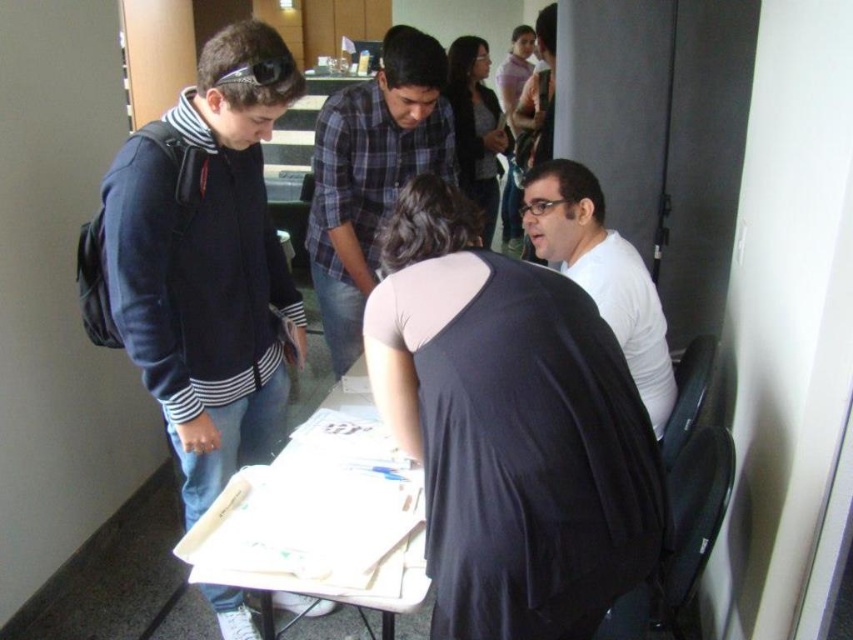
Question: Among these objects, which one is nearest to the camera?

Choices:
 (A) matte black sunglasses at upper center
 (B) white matte shirt at right

Answer: (A)

Question: Does white plastic table at center lie in front of transparent plastic glasses at center?

Choices:
 (A) yes
 (B) no

Answer: (B)

Question: Does blue plaid shirt at center appear over white matte shirt at right?

Choices:
 (A) no
 (B) yes

Answer: (B)

Question: Which of these objects is positioned closest to the matte black sunglasses at upper center?

Choices:
 (A) white plastic table at center
 (B) black matte shirt at center

Answer: (B)

Question: Is blue plaid shirt at center further to the viewer compared to white matte shirt at right?

Choices:
 (A) yes
 (B) no

Answer: (A)

Question: Which object is closer to the camera taking this photo?

Choices:
 (A) black matte shirt at center
 (B) blue plaid shirt at center
 (C) matte black sunglasses at upper center

Answer: (A)